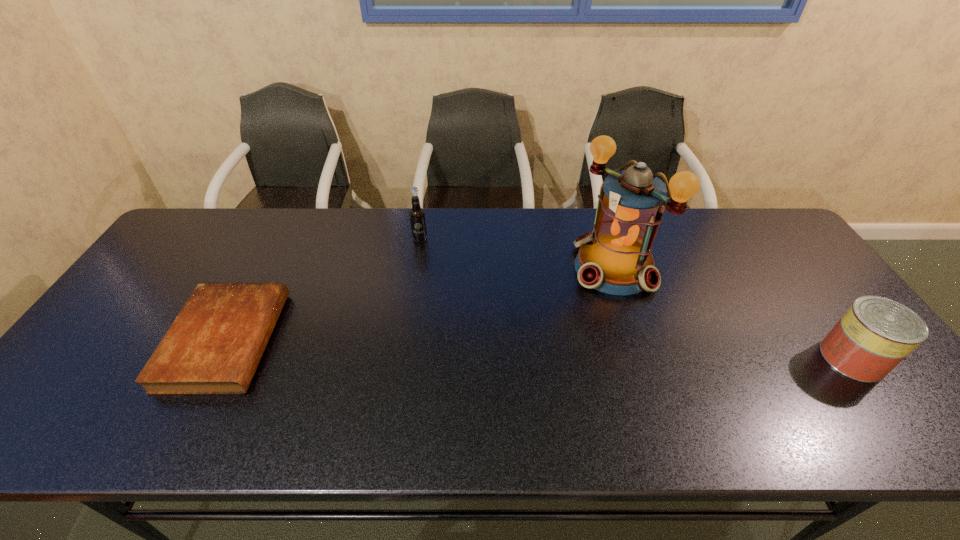
You are a GUI agent. You are given a task and a screenshot of the screen. Output one action in this format:
    pyautogui.click(x=<x>, y=<y>)
    Task: Click on the vacant region located on the front-facing side of the lantern
    
    Given the screenshot: What is the action you would take?
    pyautogui.click(x=493, y=353)

Image resolution: width=960 pixels, height=540 pixels. In order to click on blank space located 0.340m on the front-facing side of the lantern in this screenshot , I will do `click(499, 349)`.

Locate an element on the screen. vacant space positioned on the front-facing side of the lantern is located at coordinates (546, 316).

This screenshot has height=540, width=960. In order to click on vacant space situated 0.280m on the label of the root beer in this screenshot , I will do `click(435, 307)`.

Identify the location of vacant area situated 0.400m on the label of the root beer. The height and width of the screenshot is (540, 960). (443, 341).

At what (x,y) coordinates should I click in order to perform the action: click on blank space located 0.170m on the label of the root beer. Please return your answer as a coordinate pair (x, y). This screenshot has height=540, width=960. Looking at the image, I should click on (429, 279).

Find the location of a particular element. Image resolution: width=960 pixels, height=540 pixels. lantern located at the far edge is located at coordinates (615, 258).

You are a GUI agent. You are given a task and a screenshot of the screen. Output one action in this format:
    pyautogui.click(x=<x>, y=<y>)
    Task: Click on the root beer that is at the far edge
    The width and height of the screenshot is (960, 540).
    Given the screenshot: What is the action you would take?
    pyautogui.click(x=417, y=216)

Where is `Bible located at the near edge`? Bible located at the near edge is located at coordinates (213, 347).

Locate an element on the screen. Image resolution: width=960 pixels, height=540 pixels. can that is at the near edge is located at coordinates (875, 334).